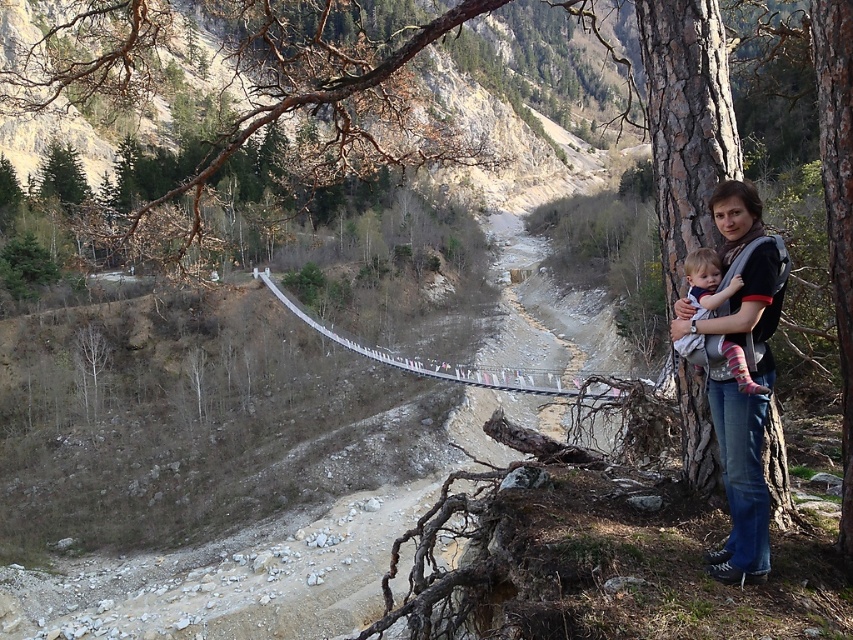
You are a hiker planning to cross the white fabric suspension bridge at center. You notice the soft pink socks at right near the path. Which object is closer to you as you stand at the starting point of the bridge?

The soft pink socks at right are closer to you than the white fabric suspension bridge at center since the bridge is further away.

In the serene mountain scene, there is a white fabric suspension bridge at center and soft pink socks at right. From the perspective of someone standing where the woman is, which object is positioned to the left?

The white fabric suspension bridge at center is to the left of the soft pink socks at right from the woman standing position.